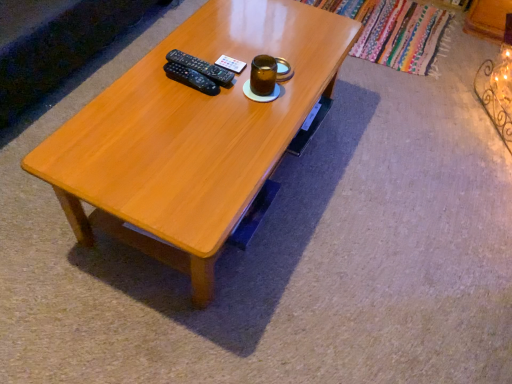
This screenshot has width=512, height=384. I want to click on vacant space in front of brown glass jar at upper center, so click(x=242, y=123).